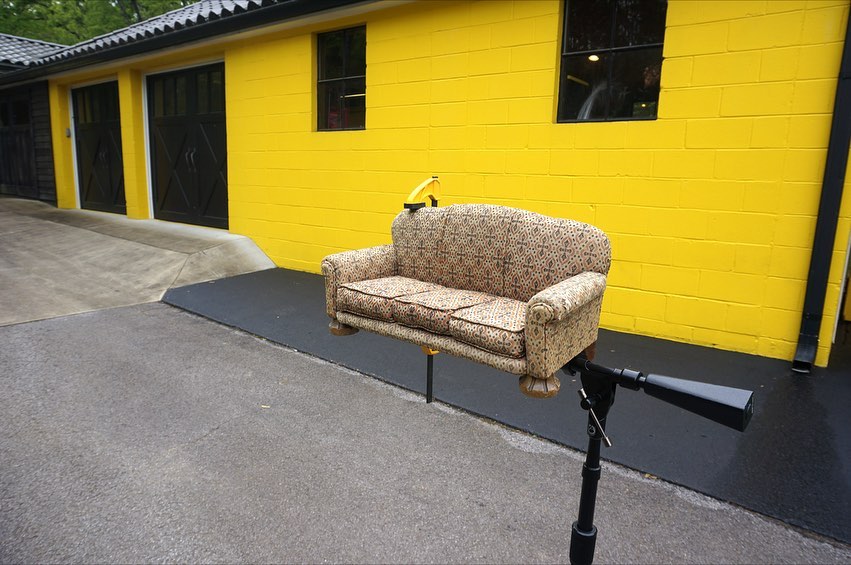
Locate an element on the screen. middle cushion is located at coordinates (431, 315).